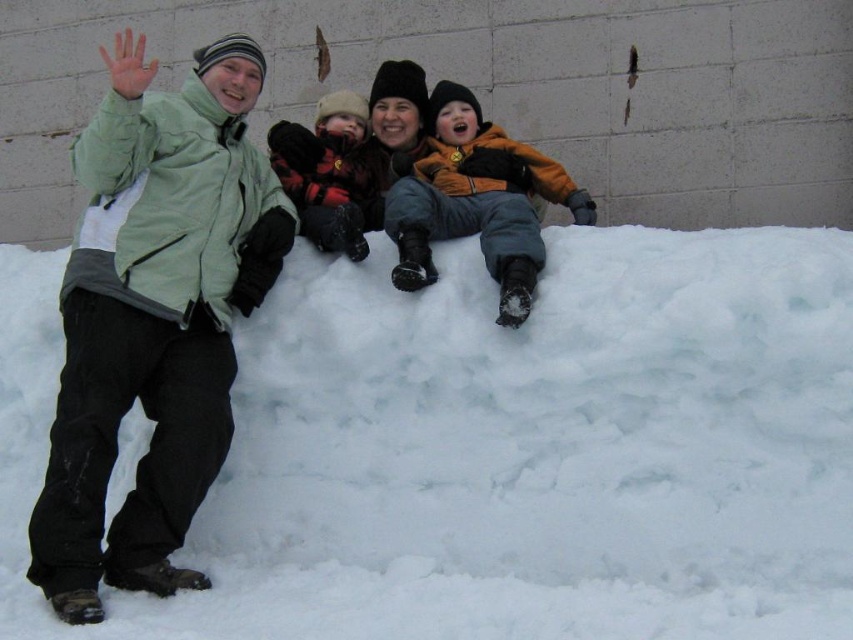
Can you confirm if white fluffy snow at lower center is positioned to the left of flannel shirt at center?

Incorrect, white fluffy snow at lower center is not on the left side of flannel shirt at center.

Between white fluffy snow at lower center and flannel shirt at center, which one appears on the right side from the viewer's perspective?

white fluffy snow at lower center is more to the right.

This screenshot has width=853, height=640. In order to click on white fluffy snow at lower center in this screenshot , I will do `click(500, 448)`.

Which is more to the right, green matte jacket at left or flannel shirt at center?

Positioned to the right is flannel shirt at center.

What do you see at coordinates (154, 316) in the screenshot?
I see `green matte jacket at left` at bounding box center [154, 316].

Find the location of a particular element. The image size is (853, 640). green matte jacket at left is located at coordinates (154, 316).

Looking at this image, can you confirm if green matte jacket at left is positioned above orange fleece jacket at center?

Incorrect, green matte jacket at left is not positioned above orange fleece jacket at center.

Between point (160, 576) and point (398, 228), which one is positioned in front?

Point (160, 576) is more forward.

The image size is (853, 640). I want to click on green matte jacket at left, so click(154, 316).